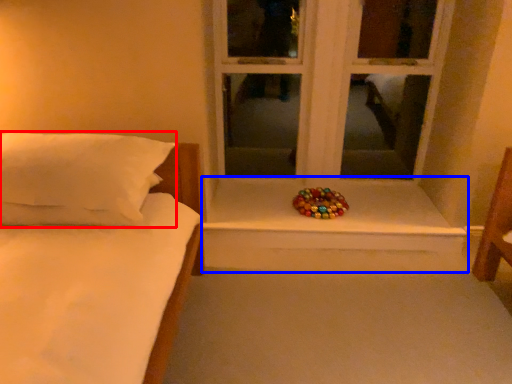
Question: Which object is further to the camera taking this photo, pillow (highlighted by a red box) or window sill (highlighted by a blue box)?

Choices:
 (A) pillow
 (B) window sill

Answer: (B)